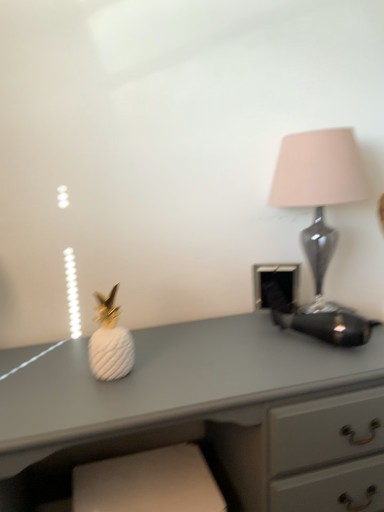
Find the location of `vacant space positioned to the left of matte glass lamp at right`. vacant space positioned to the left of matte glass lamp at right is located at coordinates (231, 335).